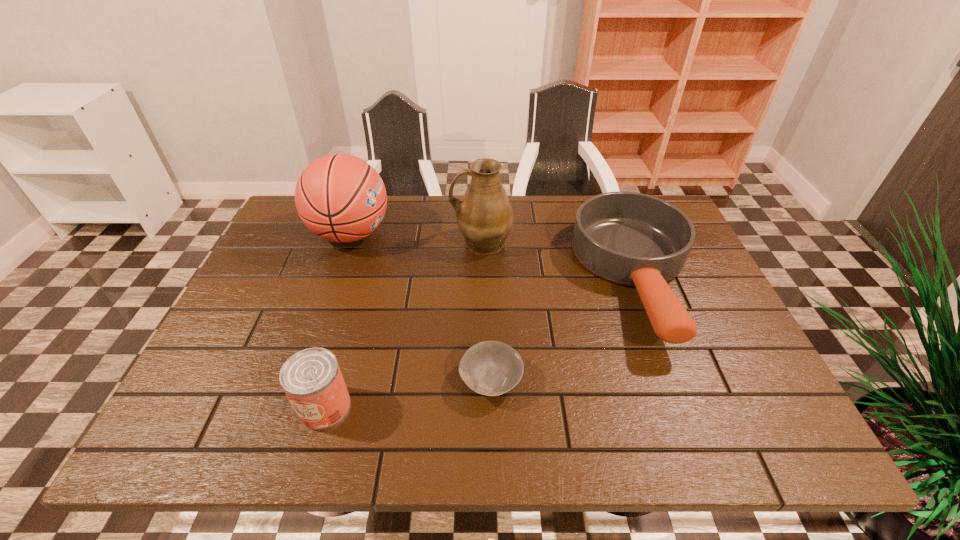
Locate an element on the screen. vacant point located between the can and the pitcher is located at coordinates (403, 325).

This screenshot has height=540, width=960. In order to click on free space between the pitcher and the pan in this screenshot , I will do `click(559, 261)`.

Find the location of a particular element. Image resolution: width=960 pixels, height=540 pixels. free space between the basketball and the shortest object is located at coordinates (420, 307).

You are a GUI agent. You are given a task and a screenshot of the screen. Output one action in this format:
    pyautogui.click(x=<x>, y=<y>)
    Task: Click on the vacant region between the can and the basketball
    
    Given the screenshot: What is the action you would take?
    pyautogui.click(x=338, y=320)

Choose which object is the nearest neighbor to the can. Please provide its 2D coordinates. Your answer should be formatted as a tuple, i.e. [(x, y)], where the tuple contains the x and y coordinates of a point satisfying the conditions above.

[(492, 368)]

Image resolution: width=960 pixels, height=540 pixels. I want to click on object identified as the third closest to the basketball, so click(x=312, y=380).

Find the location of a particular element. This screenshot has width=960, height=540. free point that satisfies the following two spatial constraints: 1. on the handle side of the pitcher; 2. on the logo side of the basketball is located at coordinates (482, 234).

Where is `free space in the image that satisfies the following two spatial constraints: 1. on the logo side of the can; 2. on the left side of the basketball`? free space in the image that satisfies the following two spatial constraints: 1. on the logo side of the can; 2. on the left side of the basketball is located at coordinates (290, 407).

The image size is (960, 540). Find the location of `vacant area in the image that satisfies the following two spatial constraints: 1. on the back side of the can; 2. on the handle side of the pitcher`. vacant area in the image that satisfies the following two spatial constraints: 1. on the back side of the can; 2. on the handle side of the pitcher is located at coordinates (372, 242).

Find the location of a particular element. Image resolution: width=960 pixels, height=540 pixels. vacant space that satisfies the following two spatial constraints: 1. on the logo side of the can; 2. on the left side of the basketball is located at coordinates (290, 407).